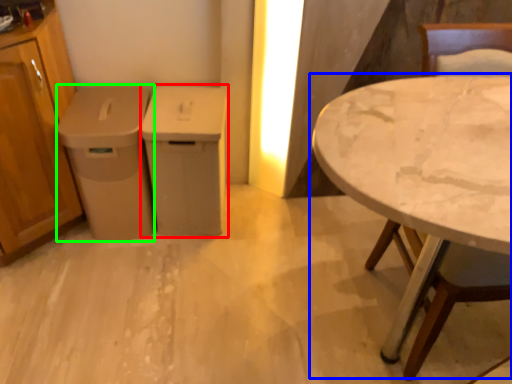
Question: Based on their relative distances, which object is farther from cabinetry (highlighted by a red box)? Choose from table (highlighted by a blue box) and cabinetry (highlighted by a green box).

Choices:
 (A) table
 (B) cabinetry

Answer: (A)